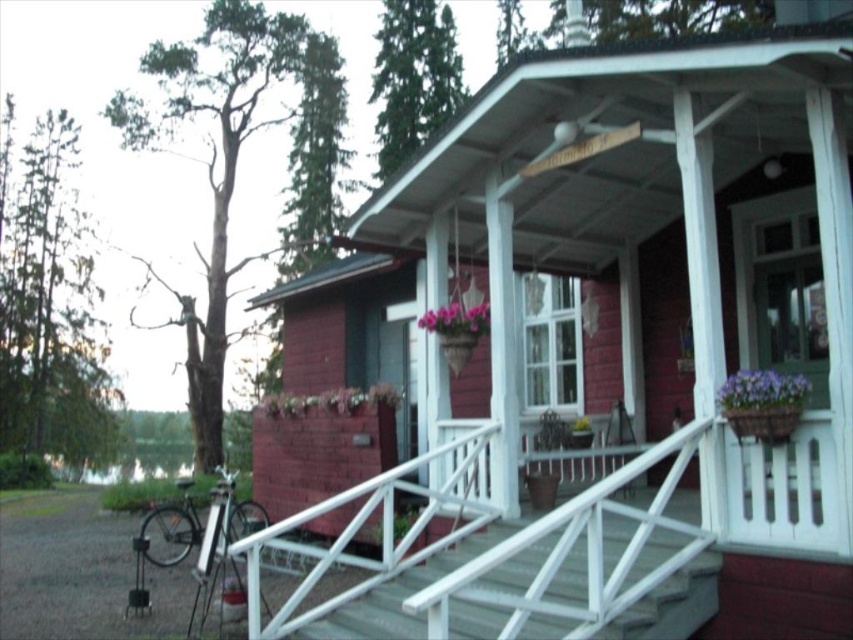
Is white painted wood porch at center shorter than white wooden stairs at center?

No, white painted wood porch at center is not shorter than white wooden stairs at center.

Is point (447, 486) closer to viewer compared to point (578, 595)?

No.

Locate an element on the screen. The height and width of the screenshot is (640, 853). white painted wood porch at center is located at coordinates (659, 524).

Does white painted wood porch at center appear on the right side of purple matte flower pot at center?

Correct, you'll find white painted wood porch at center to the right of purple matte flower pot at center.

Which is above, white painted wood porch at center or purple matte flower pot at center?

white painted wood porch at center

Identify the location of white painted wood porch at center. This screenshot has height=640, width=853. (659, 524).

Which is above, white painted wood porch at center or purple fabric flower at center?

purple fabric flower at center is above.

Does white painted wood porch at center have a smaller size compared to purple fabric flower at center?

Incorrect, white painted wood porch at center is not smaller in size than purple fabric flower at center.

Who is more forward, (x=721, y=502) or (x=459, y=310)?

Positioned in front is point (x=721, y=502).

What are the coordinates of `white painted wood porch at center` in the screenshot? It's located at (659, 524).